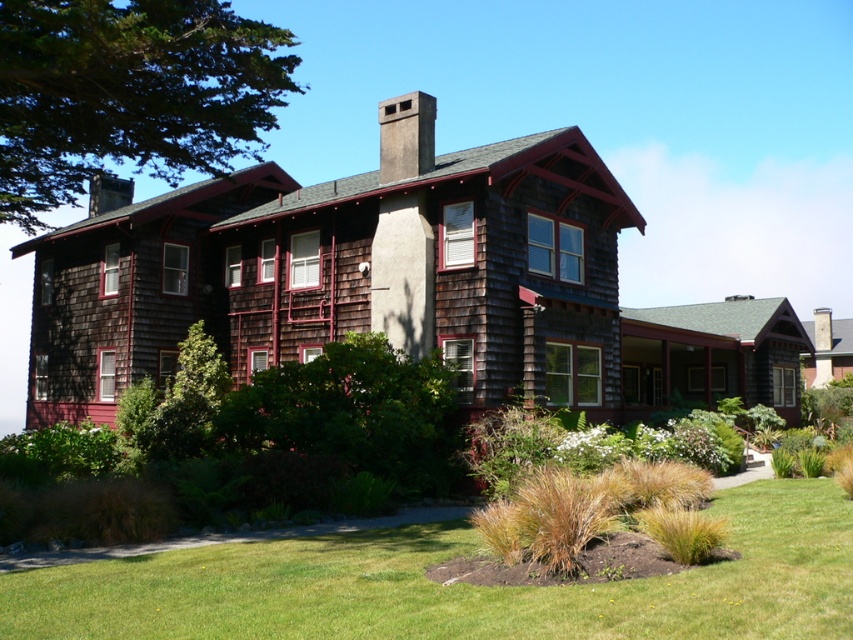
Question: Can you confirm if green leafy tree at upper left is wider than smooth gray chimney at upper center?

Choices:
 (A) yes
 (B) no

Answer: (A)

Question: Estimate the real-world distances between objects in this image. Which object is farther from the smooth gray chimney at upper center?

Choices:
 (A) brown shingles at upper center
 (B) green leafy tree at upper left

Answer: (B)

Question: Is green grass at lower center closer to camera compared to brown shingles at upper center?

Choices:
 (A) no
 (B) yes

Answer: (B)

Question: Estimate the real-world distances between objects in this image. Which object is farther from the green leafy tree at upper left?

Choices:
 (A) brown shingles at upper center
 (B) smooth gray chimney at upper center

Answer: (B)

Question: Estimate the real-world distances between objects in this image. Which object is closer to the smooth gray chimney at upper center?

Choices:
 (A) green leafy tree at upper left
 (B) green grass at lower center
 (C) brown shingles at upper center

Answer: (C)

Question: Does brown shingles at upper center have a smaller size compared to smooth gray chimney at upper center?

Choices:
 (A) yes
 (B) no

Answer: (B)